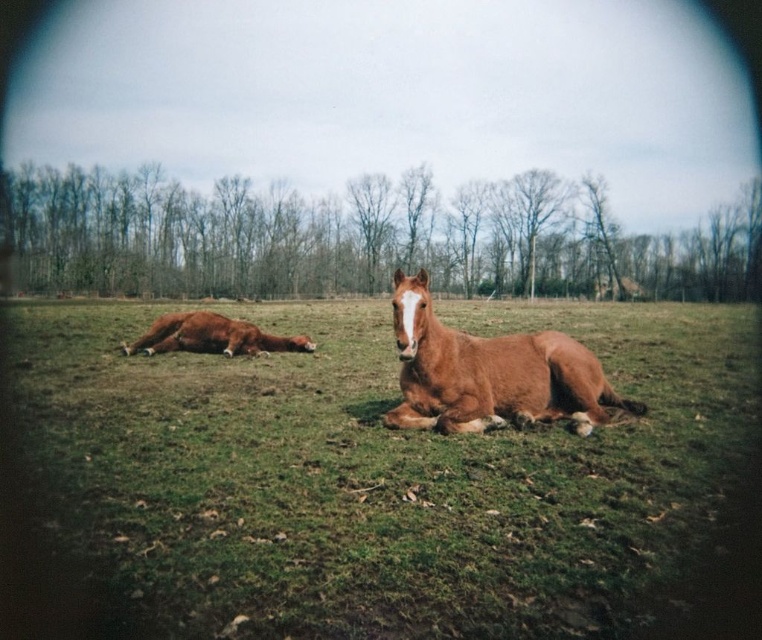
You are a photographer aiming to capture a closeup shot of the brown horse at center and the brown glossy horse at center. Based on their positions, which horse would appear larger in your photo?

The brown horse at center would appear larger in the photo because it is closer to the viewer than the brown glossy horse at center.

You are a photographer trying to capture both the brown horse at center and the brown glossy horse at center in a single shot. Based on their positions, which horse should you adjust your camera angle to focus on first to ensure both are in frame?

Since the brown horse at center is to the right of the brown glossy horse at center, you should first focus on the brown glossy horse at center to ensure both are included in the frame.